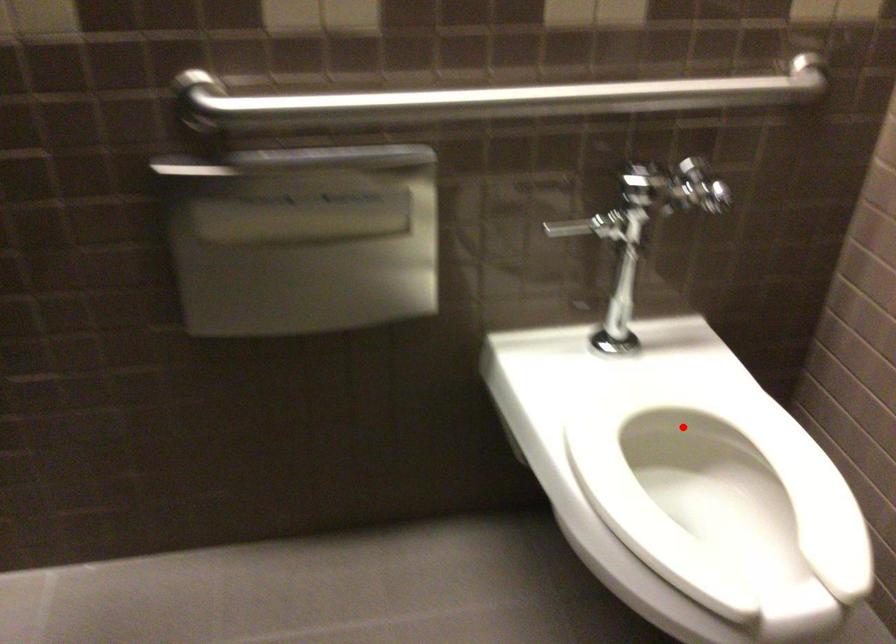
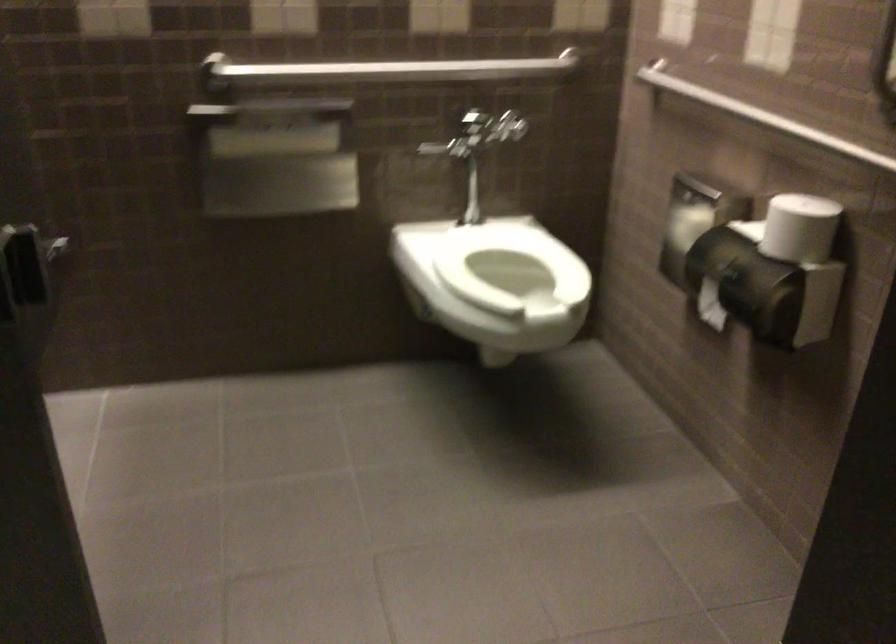
In the second image, find the point that corresponds to the highlighted location in the first image.

(509, 263)